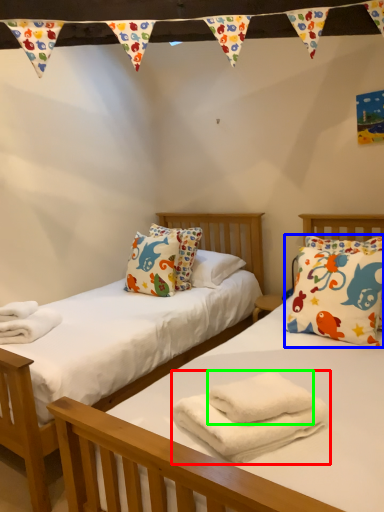
Question: Which object is the closest to the bath towel (highlighted by a red box)? Choose among these: pillow (highlighted by a blue box) or bath towel (highlighted by a green box).

Choices:
 (A) pillow
 (B) bath towel

Answer: (B)